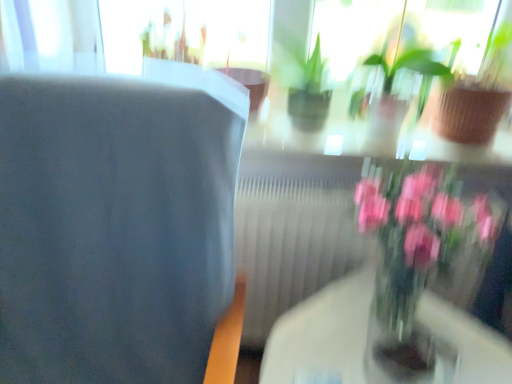
Where is `free space underneath pink glass vase at right (from a real-world perspective)`? Image resolution: width=512 pixels, height=384 pixels. free space underneath pink glass vase at right (from a real-world perspective) is located at coordinates (394, 325).